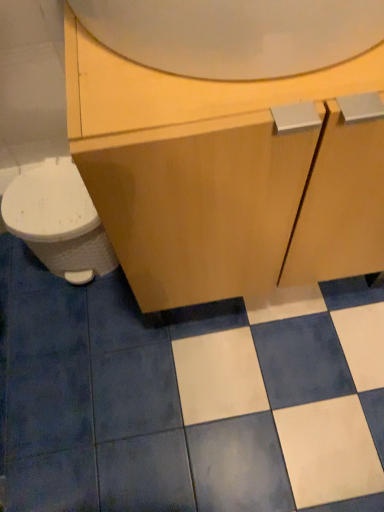
Describe the element at coordinates (225, 175) in the screenshot. I see `matte wood cabinet at center` at that location.

Describe the element at coordinates (234, 34) in the screenshot. I see `white glossy mirror at upper center` at that location.

In order to click on matte wood cabinet at center in this screenshot , I will do `click(225, 175)`.

Between point (68, 490) and point (271, 179), which one is positioned behind?

Positioned behind is point (68, 490).

Does white glossy tile at center turn towards matte wood cabinet at center?

No, white glossy tile at center does not turn towards matte wood cabinet at center.

From the picture: Is white glossy tile at center not inside matte wood cabinet at center?

white glossy tile at center lies outside matte wood cabinet at center's area.

Which is behind, white glossy tile at center or matte wood cabinet at center?

white glossy tile at center is further from the camera.

Who is bigger, white glossy toilet at left or white glossy tile at center?

With larger size is white glossy tile at center.

Could white glossy tile at center be considered to be inside white glossy toilet at left?

No, white glossy toilet at left does not contain white glossy tile at center.

Is white glossy toilet at left facing towards white glossy tile at center?

No, white glossy toilet at left is not turned towards white glossy tile at center.

Which is behind, point (86, 238) or point (323, 493)?

The point (86, 238) is farther.

Is white glossy mirror at upper center not inside white glossy tile at center?

Yes, white glossy mirror at upper center is outside of white glossy tile at center.

Considering the relative sizes of white glossy mirror at upper center and white glossy tile at center in the image provided, is white glossy mirror at upper center wider than white glossy tile at center?

Incorrect, the width of white glossy mirror at upper center does not surpass that of white glossy tile at center.

From a real-world perspective, does white glossy mirror at upper center sit lower than white glossy tile at center?

No, from a real-world perspective, white glossy mirror at upper center is not beneath white glossy tile at center.

Is white glossy mirror at upper center oriented away from matte wood cabinet at center?

No, matte wood cabinet at center is not at the back of white glossy mirror at upper center.

Are white glossy mirror at upper center and matte wood cabinet at center located far from each other?

white glossy mirror at upper center is actually quite close to matte wood cabinet at center.

From the image's perspective, is white glossy mirror at upper center on matte wood cabinet at center?

Yes, from the image's perspective, white glossy mirror at upper center is on top of matte wood cabinet at center.

From a real-world perspective, is white glossy mirror at upper center positioned over matte wood cabinet at center based on gravity?

Yes, from a real-world perspective, white glossy mirror at upper center is above matte wood cabinet at center.

Can you see white glossy mirror at upper center touching white glossy toilet at left?

No, white glossy mirror at upper center is not in contact with white glossy toilet at left.

Considering the relative positions of white glossy mirror at upper center and white glossy toilet at left in the image provided, is white glossy mirror at upper center behind white glossy toilet at left?

No, it is in front of white glossy toilet at left.

Does white glossy mirror at upper center appear on the right side of white glossy toilet at left?

Yes.

From the image's perspective, which object appears higher, white glossy mirror at upper center or white glossy toilet at left?

From the image's view, white glossy mirror at upper center is above.

From the picture: From the image's perspective, is matte wood cabinet at center under white glossy tile at center?

No, from the image's perspective, matte wood cabinet at center is not beneath white glossy tile at center.

Considering the sizes of matte wood cabinet at center and white glossy tile at center in the image, is matte wood cabinet at center wider or thinner than white glossy tile at center?

Considering their sizes, matte wood cabinet at center looks slimmer than white glossy tile at center.

Is there a large distance between matte wood cabinet at center and white glossy tile at center?

No, matte wood cabinet at center is not far from white glossy tile at center.

From the picture: Between white glossy toilet at left and white glossy mirror at upper center, which one is positioned in front?

A: Positioned in front is white glossy mirror at upper center.

Which of these two, white glossy toilet at left or white glossy mirror at upper center, is wider?

white glossy mirror at upper center is wider.

Is white glossy toilet at left aimed at white glossy mirror at upper center?

No, white glossy toilet at left does not turn towards white glossy mirror at upper center.

At what (x,y) coordinates should I click in order to perform the action: click on ceramic tile below the matte wood cabinet at center (from the image's perspective). Please return your answer as a coordinate pair (x, y). This screenshot has width=384, height=512. Looking at the image, I should click on (188, 398).

Identify the location of ceramic tile that appears on the right of white glossy toilet at left. This screenshot has width=384, height=512. (188, 398).

From the image, which object appears to be farther from matte wood cabinet at center, white glossy tile at center or white glossy mirror at upper center?

white glossy tile at center lies further to matte wood cabinet at center than the other object.

From the image, which object appears to be farther from matte wood cabinet at center, white glossy toilet at left or white glossy mirror at upper center?

Based on the image, white glossy toilet at left appears to be further to matte wood cabinet at center.

Which object lies nearer to the anchor point white glossy toilet at left, white glossy mirror at upper center or white glossy tile at center?

white glossy tile at center is closer to white glossy toilet at left.

When comparing their distances from white glossy tile at center, does matte wood cabinet at center or white glossy toilet at left seem closer?

Among the two, white glossy toilet at left is located nearer to white glossy tile at center.

Based on the photo, from the image, which object appears to be nearer to matte wood cabinet at center, white glossy tile at center or white glossy toilet at left?

white glossy toilet at left lies closer to matte wood cabinet at center than the other object.

Looking at the image, which one is located closer to matte wood cabinet at center, white glossy mirror at upper center or white glossy tile at center?

white glossy mirror at upper center is closer to matte wood cabinet at center.

When comparing their distances from white glossy tile at center, does white glossy toilet at left or white glossy mirror at upper center seem further?

The object further to white glossy tile at center is white glossy mirror at upper center.

Based on their spatial positions, is white glossy mirror at upper center or white glossy toilet at left closer to matte wood cabinet at center?

white glossy mirror at upper center is positioned closer to the anchor matte wood cabinet at center.

Find the location of a particular element. bathroom cabinet between white glossy mirror at upper center and white glossy tile at center in the up-down direction is located at coordinates (225, 175).

This screenshot has height=512, width=384. What are the coordinates of `bathroom cabinet between white glossy mirror at upper center and white glossy toilet at left along the z-axis` in the screenshot? It's located at click(x=225, y=175).

Find the location of `ceramic tile between white glossy mirror at upper center and white glossy toilet at left from front to back`. ceramic tile between white glossy mirror at upper center and white glossy toilet at left from front to back is located at coordinates (188, 398).

This screenshot has height=512, width=384. Identify the location of ceramic tile between white glossy toilet at left and matte wood cabinet at center in the horizontal direction. (188, 398).